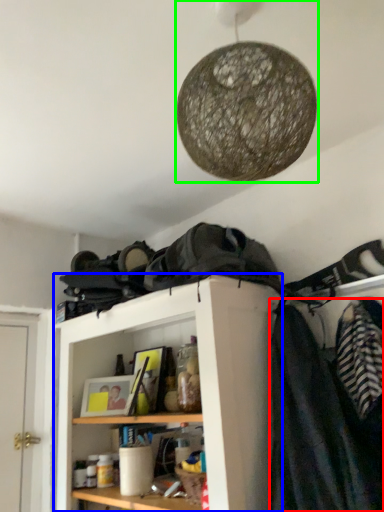
Question: Which is farther away from clothing (highlighted by a red box)? shelf (highlighted by a blue box) or lamp (highlighted by a green box)?

Choices:
 (A) shelf
 (B) lamp

Answer: (B)